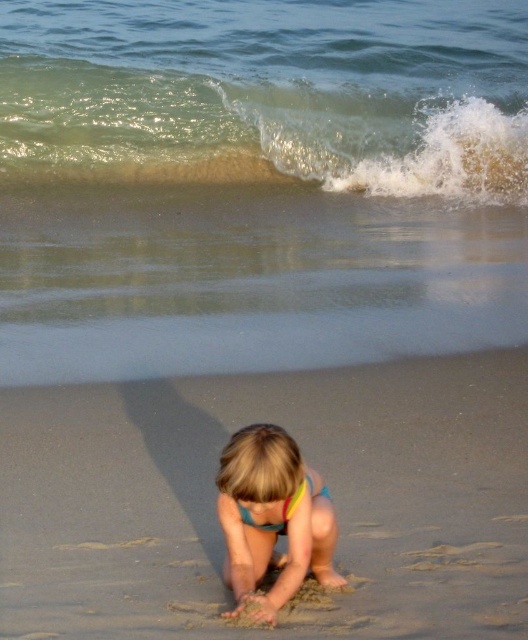
Measure the distance between point [216,248] and camera.

Point [216,248] is 11.09 meters from camera.

Does greenish sand at upper center appear over multicolored swimsuit at center?

Indeed, greenish sand at upper center is positioned over multicolored swimsuit at center.

Where is `greenish sand at upper center`? This screenshot has height=640, width=528. greenish sand at upper center is located at coordinates (259, 184).

What do you see at coordinates (308, 461) in the screenshot? The width and height of the screenshot is (528, 640). I see `fine-grained sand at lower center` at bounding box center [308, 461].

Is fine-grained sand at lower center positioned behind multicolored swimsuit at center?

Yes, it is behind multicolored swimsuit at center.

Does point (136, 477) come in front of point (282, 449)?

No.

Identify the location of fine-grained sand at lower center. (308, 461).

Who is higher up, greenish sand at upper center or translucent green water at upper center?

greenish sand at upper center is higher up.

Is point (354, 300) behind point (266, 138)?

No, it is not.

Measure the distance between greenish sand at upper center and camera.

23.37 feet

Image resolution: width=528 pixels, height=640 pixels. What are the coordinates of `greenish sand at upper center` in the screenshot? It's located at (259, 184).